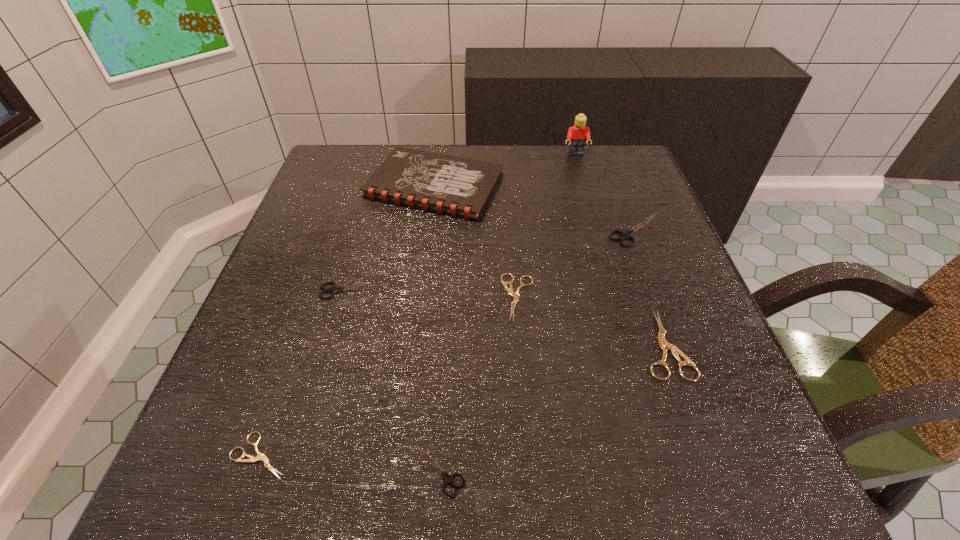
What are the coordinates of `the third shears from left to right` in the screenshot? It's located at (449, 479).

This screenshot has width=960, height=540. I want to click on the shortest shears, so click(260, 456).

This screenshot has height=540, width=960. I want to click on the leftmost beige shears, so click(260, 456).

Locate an element on the screen. The image size is (960, 540). blank space located 0.120m on the face of the tallest object is located at coordinates [x=584, y=183].

Locate an element on the screen. free spot located 0.330m on the front of the seventh shortest object is located at coordinates (415, 341).

Locate an element on the screen. vacant space located 0.100m on the left of the third tallest object is located at coordinates (562, 230).

Locate an element on the screen. The height and width of the screenshot is (540, 960). vacant area situated on the right of the second biggest black shears is located at coordinates (558, 291).

This screenshot has width=960, height=540. I want to click on free space located 0.200m on the back of the rightmost beige shears, so click(x=628, y=240).

The height and width of the screenshot is (540, 960). I want to click on free region located on the back of the second beige shears from right to left, so click(510, 188).

Identify the location of vacant space positioned on the left of the second black shears from right to left. (222, 470).